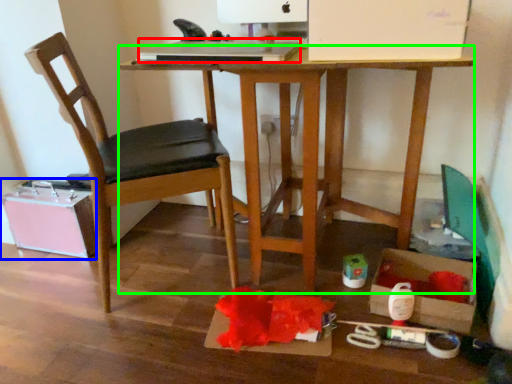
Question: Which is farther away from laptop (highlighted by a red box)? storage box (highlighted by a blue box) or desk (highlighted by a green box)?

Choices:
 (A) storage box
 (B) desk

Answer: (A)